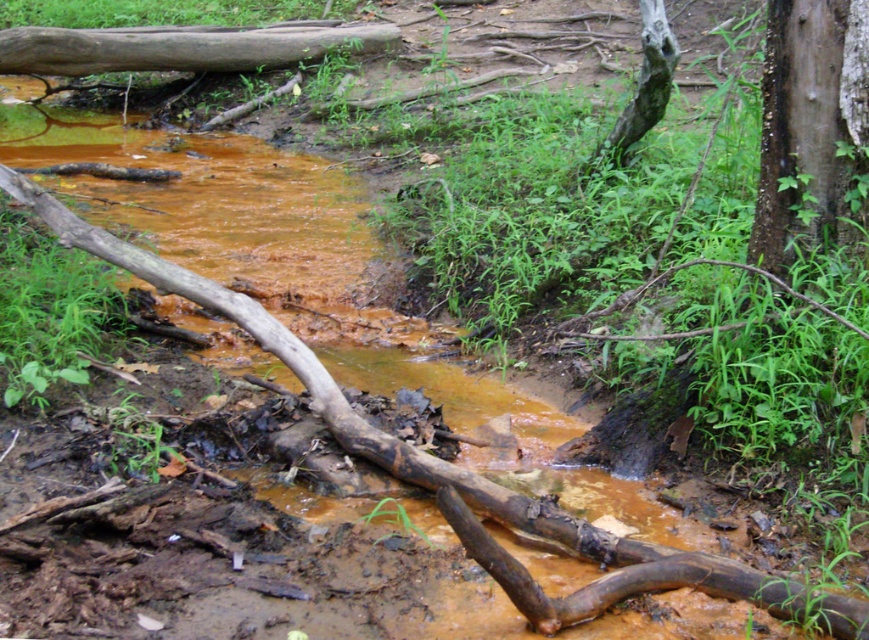
Can you confirm if green rough bark tree trunk at upper right is shorter than brown rough log at upper left?

No, green rough bark tree trunk at upper right is not shorter than brown rough log at upper left.

You are a GUI agent. You are given a task and a screenshot of the screen. Output one action in this format:
    pyautogui.click(x=<x>, y=<y>)
    Task: Click on the green rough bark tree trunk at upper right
    Image resolution: width=869 pixels, height=640 pixels.
    Given the screenshot: What is the action you would take?
    pyautogui.click(x=811, y=128)

Locate an element on the screen. Image resolution: width=869 pixels, height=640 pixels. green rough bark tree trunk at upper right is located at coordinates [811, 128].

Between brown rough log at upper left and gray rough tree trunk at upper right, which one is positioned higher?

Positioned higher is brown rough log at upper left.

Is brown rough log at upper left to the right of gray rough tree trunk at upper right from the viewer's perspective?

Incorrect, brown rough log at upper left is not on the right side of gray rough tree trunk at upper right.

Where is `brown rough log at upper left`? Image resolution: width=869 pixels, height=640 pixels. brown rough log at upper left is located at coordinates (181, 48).

Does green rough bark tree trunk at upper right have a lesser width compared to gray rough tree trunk at upper right?

No, green rough bark tree trunk at upper right is not thinner than gray rough tree trunk at upper right.

Can you confirm if green rough bark tree trunk at upper right is shorter than gray rough tree trunk at upper right?

Incorrect, green rough bark tree trunk at upper right's height does not fall short of gray rough tree trunk at upper right's.

Identify the location of green rough bark tree trunk at upper right. This screenshot has height=640, width=869. (811, 128).

You are a GUI agent. You are given a task and a screenshot of the screen. Output one action in this format:
    pyautogui.click(x=<x>, y=<y>)
    Task: Click on the green rough bark tree trunk at upper right
    The height and width of the screenshot is (640, 869).
    Given the screenshot: What is the action you would take?
    pyautogui.click(x=811, y=128)